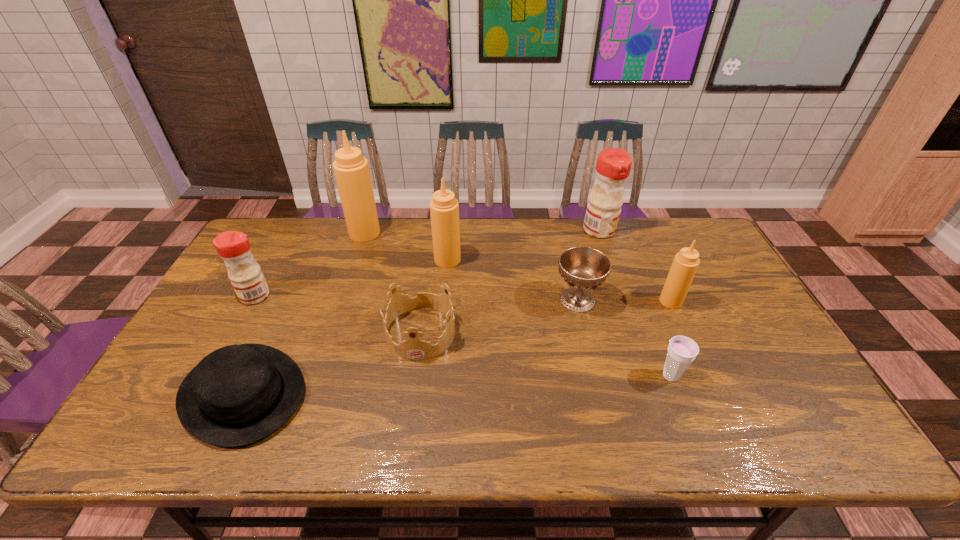
At what (x,y) coordinates should I click in order to perform the action: click on chalice. Please return your answer as a coordinate pair (x, y). The image size is (960, 540). Looking at the image, I should click on (583, 268).

Where is `red chalice`? The image size is (960, 540). red chalice is located at coordinates (583, 268).

Find the location of `tiara`. tiara is located at coordinates (413, 348).

Identify the location of purple cup. This screenshot has height=540, width=960. (682, 350).

Where is `fedora`? fedora is located at coordinates (239, 394).

Image resolution: width=960 pixels, height=540 pixels. In order to click on black fedora in this screenshot , I will do `click(239, 394)`.

This screenshot has height=540, width=960. I want to click on vacant region located 0.170m on the front of the farthest tan condiment, so click(x=351, y=275).

Locate an element on the screen. free location located 0.360m on the front of the farther red condiment is located at coordinates (629, 316).

Locate an element on the screen. free space located 0.320m on the left of the second tan condiment from right to left is located at coordinates (337, 260).

Find the location of a particular element. free region located 0.270m on the left of the rightmost tan condiment is located at coordinates (568, 301).